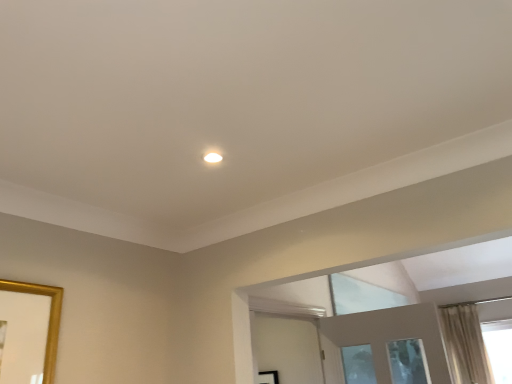
This screenshot has width=512, height=384. What are the coordinates of `beige curtain at upper right` in the screenshot? It's located at (465, 344).

The height and width of the screenshot is (384, 512). What do you see at coordinates (465, 344) in the screenshot? I see `beige curtain at upper right` at bounding box center [465, 344].

You are a GUI agent. You are given a task and a screenshot of the screen. Output one action in this format:
    pyautogui.click(x=<x>, y=<y>)
    Task: Click on the beige curtain at upper right
    The width and height of the screenshot is (512, 384).
    Given the screenshot: What is the action you would take?
    pyautogui.click(x=465, y=344)